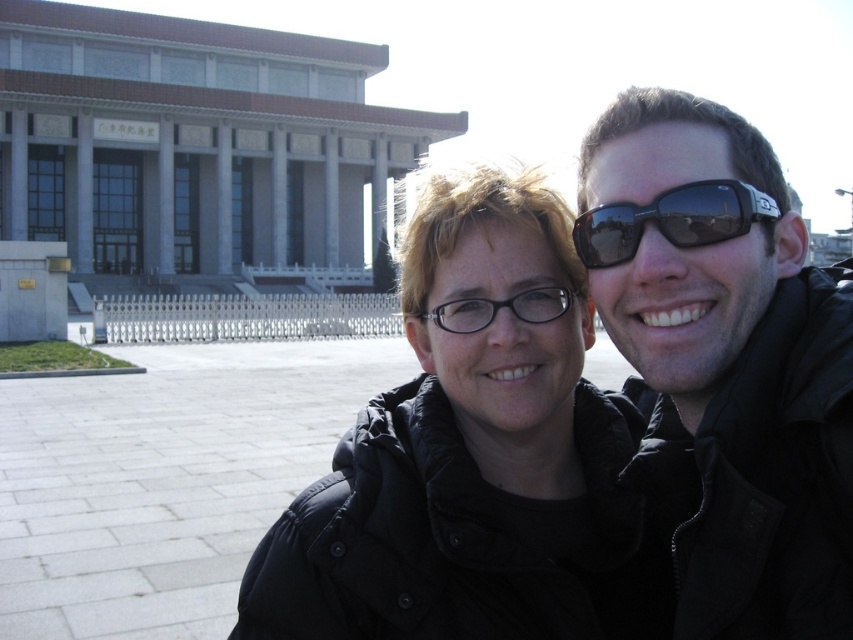
You are standing in front of a classical building and see the sunglasses at center. If you want to pick them up, where should you look?

The sunglasses at center are located at coordinates point (671,220), so you should look there to pick them up.